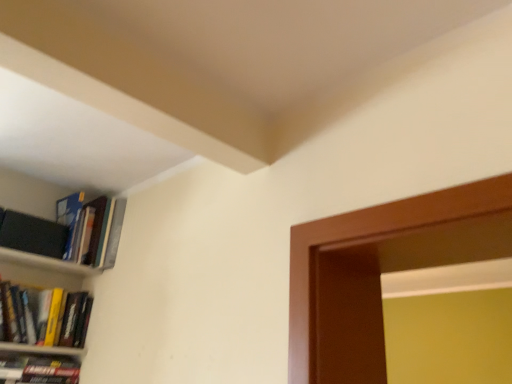
Question: Does hardcover books at upper left, placed as the first book when sorted from top to bottom, come in front of hardcover book at left, which is counted as the first book, starting from the bottom?

Choices:
 (A) no
 (B) yes

Answer: (A)

Question: Does hardcover books at upper left, placed as the first book when sorted from top to bottom, have a larger size compared to hardcover book at left, which appears as the second book when viewed from the top?

Choices:
 (A) no
 (B) yes

Answer: (B)

Question: Would you say hardcover books at upper left, placed as the first book when sorted from top to bottom, is outside hardcover book at left, which is counted as the first book, starting from the bottom?

Choices:
 (A) yes
 (B) no

Answer: (A)

Question: From a real-world perspective, is hardcover books at upper left, the second book when ordered from bottom to top, physically below hardcover book at left, which appears as the second book when viewed from the top?

Choices:
 (A) no
 (B) yes

Answer: (A)

Question: Is hardcover book at left, which is counted as the first book, starting from the bottom, inside hardcover books at upper left, placed as the first book when sorted from top to bottom?

Choices:
 (A) no
 (B) yes

Answer: (A)

Question: From the image's perspective, is hardcover books at upper left, placed as the first book when sorted from top to bottom, above hardcover book at left, which is counted as the first book, starting from the bottom?

Choices:
 (A) yes
 (B) no

Answer: (A)

Question: From the image's perspective, does hardcover book at left, which appears as the second book when viewed from the top, appear lower than hardcover books at upper left, the second book when ordered from bottom to top?

Choices:
 (A) no
 (B) yes

Answer: (B)

Question: Could you tell me if hardcover book at left, which is counted as the first book, starting from the bottom, is turned towards hardcover books at upper left, placed as the first book when sorted from top to bottom?

Choices:
 (A) yes
 (B) no

Answer: (B)

Question: Is hardcover book at left, which appears as the second book when viewed from the top, shorter than hardcover books at upper left, placed as the first book when sorted from top to bottom?

Choices:
 (A) yes
 (B) no

Answer: (A)

Question: From the image's perspective, is hardcover book at left, which appears as the second book when viewed from the top, on top of hardcover books at upper left, placed as the first book when sorted from top to bottom?

Choices:
 (A) no
 (B) yes

Answer: (A)

Question: Is hardcover book at left, which appears as the second book when viewed from the top, directly adjacent to hardcover books at upper left, the second book when ordered from bottom to top?

Choices:
 (A) no
 (B) yes

Answer: (A)

Question: From a real-world perspective, is hardcover book at left, which appears as the second book when viewed from the top, located beneath hardcover books at upper left, placed as the first book when sorted from top to bottom?

Choices:
 (A) yes
 (B) no

Answer: (A)

Question: Based on their positions, is hardcover book at left, which is counted as the first book, starting from the bottom, located to the left or right of hardcover books at upper left, placed as the first book when sorted from top to bottom?

Choices:
 (A) right
 (B) left

Answer: (B)